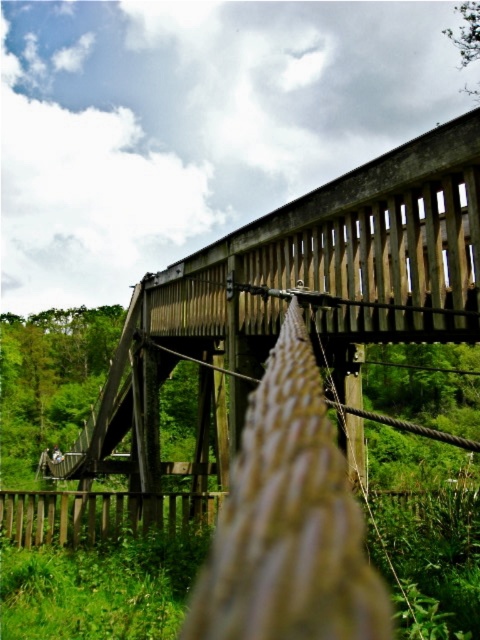
Question: From the image, what is the correct spatial relationship of wooden bridge at center in relation to brown wooden fence at lower center?

Choices:
 (A) above
 (B) below

Answer: (B)

Question: Among these objects, which one is farthest from the camera?

Choices:
 (A) wooden bridge at center
 (B) brown wooden fence at lower center

Answer: (B)

Question: Is wooden bridge at center behind brown wooden fence at lower center?

Choices:
 (A) yes
 (B) no

Answer: (B)

Question: Which of the following is the farthest from the observer?

Choices:
 (A) brown wooden fence at lower center
 (B) wooden bridge at center

Answer: (A)

Question: Which point is closer to the camera?

Choices:
 (A) brown wooden fence at lower center
 (B) wooden bridge at center

Answer: (B)

Question: Is wooden bridge at center thinner than brown wooden fence at lower center?

Choices:
 (A) no
 (B) yes

Answer: (A)